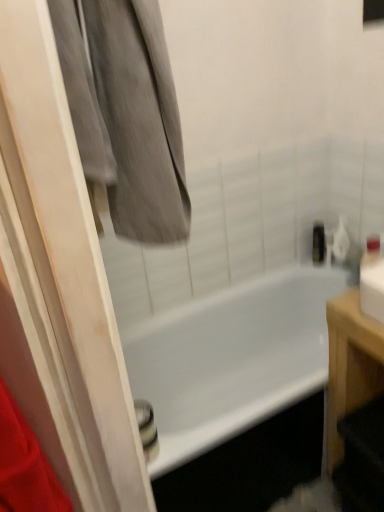
In order to face gray fabric at upper left, should I rotate leftwards or rightwards?

You should look left and rotate roughly 15.647 degrees.

You are a GUI agent. You are given a task and a screenshot of the screen. Output one action in this format:
    pyautogui.click(x=<x>, y=<y>)
    Task: Click on the gray fabric at upper left
    Image resolution: width=384 pixels, height=512 pixels.
    Given the screenshot: What is the action you would take?
    pyautogui.click(x=59, y=282)

Is light brown wooden table at right looking in the opposite direction of gray fabric at upper left?

No.

Which object is positioned more to the right, light brown wooden table at right or gray fabric at upper left?

light brown wooden table at right.

Which is in front, point (333, 349) or point (105, 495)?

The point (105, 495) is in front.

Can you tell me how much light brown wooden table at right and gray fabric at upper left differ in facing direction?

173 degrees separate the facing orientations of light brown wooden table at right and gray fabric at upper left.

Is metallic silver toiletry at upper right taller or shorter than gray fabric at upper left?

Clearly, metallic silver toiletry at upper right is shorter compared to gray fabric at upper left.

Based on the photo, is metallic silver toiletry at upper right positioned far away from gray fabric at upper left?

Yes, metallic silver toiletry at upper right is far from gray fabric at upper left.

From a real-world perspective, who is located lower, metallic silver toiletry at upper right or gray fabric at upper left?

metallic silver toiletry at upper right.

Between metallic silver toiletry at upper right and gray fabric at upper left, which one has smaller size?

metallic silver toiletry at upper right.

Can you confirm if light brown wooden table at right is shorter than white glossy bathtub at center?

No, light brown wooden table at right is not shorter than white glossy bathtub at center.

Relative to white glossy bathtub at center, is light brown wooden table at right in front or behind?

Clearly, light brown wooden table at right is in front of white glossy bathtub at center.

Are light brown wooden table at right and white glossy bathtub at center making contact?

light brown wooden table at right and white glossy bathtub at center are not in contact.

Does gray fabric at upper left have a lesser height compared to light brown wooden table at right?

Yes.

Based on the photo, which object is further away from the camera, gray fabric at upper left or light brown wooden table at right?

light brown wooden table at right is behind.

How far apart are gray fabric at upper left and light brown wooden table at right?

gray fabric at upper left and light brown wooden table at right are 33.67 inches apart from each other.

Is gray fabric at upper left next to light brown wooden table at right and touching it?

gray fabric at upper left is not next to light brown wooden table at right, and they're not touching.

Is gray fabric at upper left far from metallic silver toiletry at upper right?

Yes, gray fabric at upper left and metallic silver toiletry at upper right are located far from each other.

From the image's perspective, which object appears higher, gray fabric at upper left or metallic silver toiletry at upper right?

gray fabric at upper left, from the image's perspective.

Is gray fabric at upper left to the right of metallic silver toiletry at upper right from the viewer's perspective?

Incorrect, gray fabric at upper left is not on the right side of metallic silver toiletry at upper right.

Locate an element on the screen. screen door above the white glossy bathtub at center (from a real-world perspective) is located at coordinates (59, 282).

Is the surface of gray fabric at upper left in direct contact with white glossy bathtub at center?

No, gray fabric at upper left is not touching white glossy bathtub at center.

Between gray fabric at upper left and white glossy bathtub at center, which one appears on the left side from the viewer's perspective?

gray fabric at upper left.

From a real-world perspective, who is located higher, gray fabric at upper left or white glossy bathtub at center?

gray fabric at upper left is physically above.

Is point (330, 389) farther from camera compared to point (318, 248)?

No, it is not.

In the scene shown: In terms of size, does light brown wooden table at right appear bigger or smaller than metallic silver toiletry at upper right?

Considering their sizes, light brown wooden table at right takes up more space than metallic silver toiletry at upper right.

Is light brown wooden table at right surrounding metallic silver toiletry at upper right?

No, metallic silver toiletry at upper right is not inside light brown wooden table at right.

Identify the location of screen door on the left of light brown wooden table at right. (59, 282).

Identify the location of toiletry below the gray fabric at upper left (from the image's perspective). (318, 243).

Based on their spatial positions, is gray fabric at upper left or light brown wooden table at right closer to white glossy bathtub at center?

Among the two, light brown wooden table at right is located nearer to white glossy bathtub at center.

From the image, which object appears to be farther from metallic silver toiletry at upper right, gray fabric at upper left or light brown wooden table at right?

gray fabric at upper left.

Which object lies further to the anchor point gray fabric at upper left, white glossy bathtub at center or light brown wooden table at right?

white glossy bathtub at center.

Estimate the real-world distances between objects in this image. Which object is closer to metallic silver toiletry at upper right, light brown wooden table at right or white glossy bathtub at center?

white glossy bathtub at center is positioned closer to the anchor metallic silver toiletry at upper right.

When comparing their distances from white glossy bathtub at center, does light brown wooden table at right or gray fabric at upper left seem closer?

light brown wooden table at right is positioned closer to the anchor white glossy bathtub at center.

Based on their spatial positions, is metallic silver toiletry at upper right or gray fabric at upper left closer to light brown wooden table at right?

Based on the image, gray fabric at upper left appears to be nearer to light brown wooden table at right.

When comparing their distances from white glossy bathtub at center, does metallic silver toiletry at upper right or light brown wooden table at right seem closer?

metallic silver toiletry at upper right is positioned closer to the anchor white glossy bathtub at center.

Considering their positions, is light brown wooden table at right positioned closer to gray fabric at upper left than metallic silver toiletry at upper right?

light brown wooden table at right is closer to gray fabric at upper left.

Image resolution: width=384 pixels, height=512 pixels. In order to click on bathtub located between gray fabric at upper left and light brown wooden table at right in the left-right direction in this screenshot , I will do `click(231, 359)`.

Find the location of a particular element. bathtub between light brown wooden table at right and metallic silver toiletry at upper right in the front-back direction is located at coordinates (231, 359).

Locate an element on the screen. This screenshot has width=384, height=512. furniture between gray fabric at upper left and metallic silver toiletry at upper right in the front-back direction is located at coordinates (350, 365).

Find the location of a particular element. The image size is (384, 512). bathtub between gray fabric at upper left and metallic silver toiletry at upper right from front to back is located at coordinates [x=231, y=359].